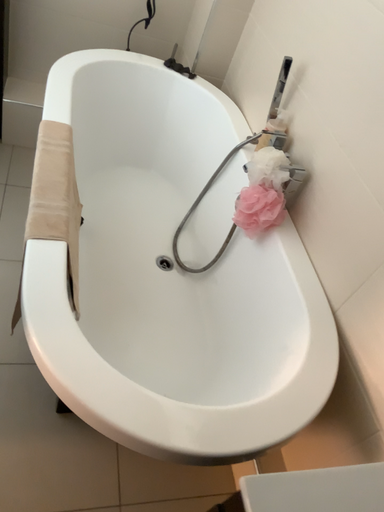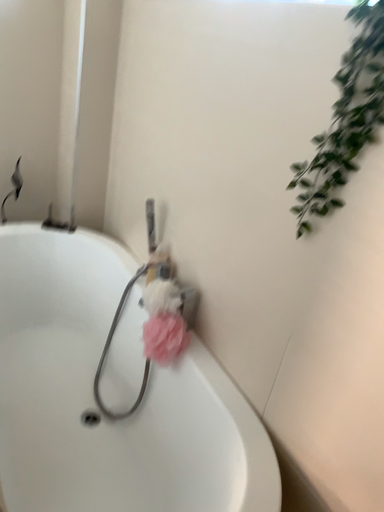
Question: Which way did the camera rotate in the video?

Choices:
 (A) rotated upward
 (B) rotated downward

Answer: (A)